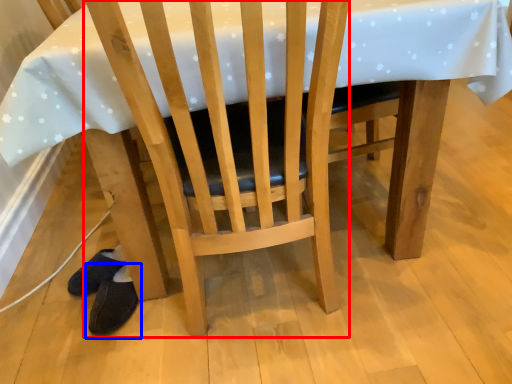
Question: Which object is closer to the camera taking this photo, chair (highlighted by a red box) or footwear (highlighted by a blue box)?

Choices:
 (A) chair
 (B) footwear

Answer: (A)